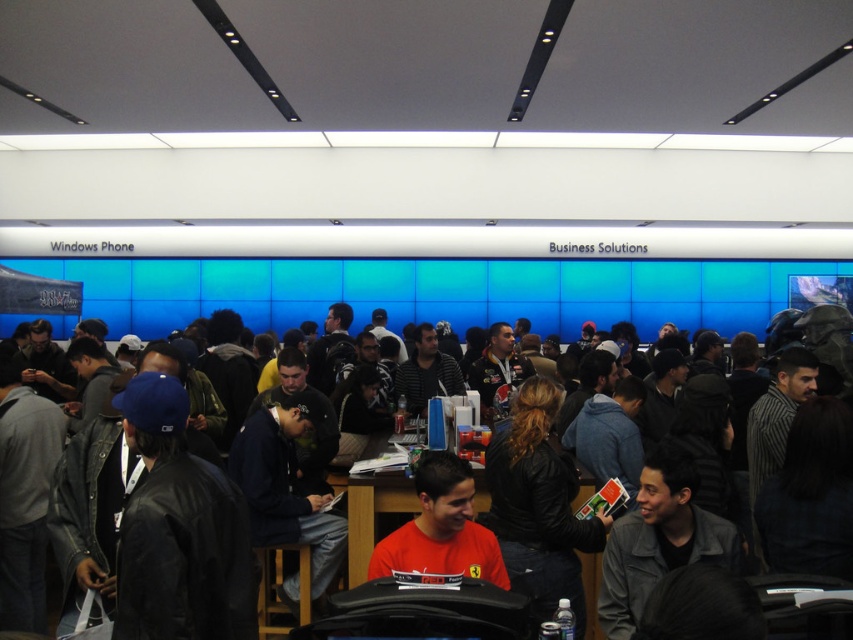
Question: Observing the image, what is the correct spatial positioning of matte red shirt at center in reference to red shirt at center?

Choices:
 (A) above
 (B) below

Answer: (A)

Question: Observing the image, what is the correct spatial positioning of matte red shirt at center in reference to red shirt at center?

Choices:
 (A) right
 (B) left

Answer: (A)

Question: Which point is farther from the camera taking this photo?

Choices:
 (A) (453, 570)
 (B) (381, 474)

Answer: (B)

Question: Does matte red shirt at center appear on the left side of red shirt at center?

Choices:
 (A) yes
 (B) no

Answer: (B)

Question: Which point is closer to the camera taking this photo?

Choices:
 (A) (392, 493)
 (B) (496, 564)

Answer: (B)